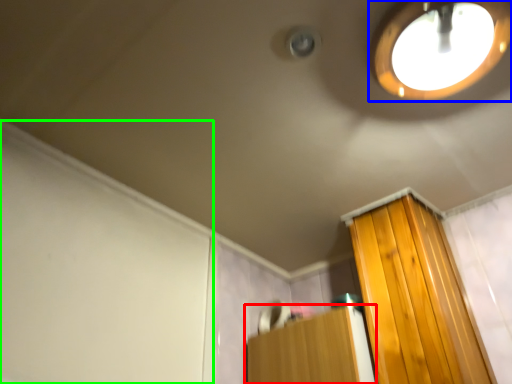
Question: Which is farther away from furniture (highlighted by a red box)? droplight (highlighted by a blue box) or screen door (highlighted by a green box)?

Choices:
 (A) droplight
 (B) screen door

Answer: (A)